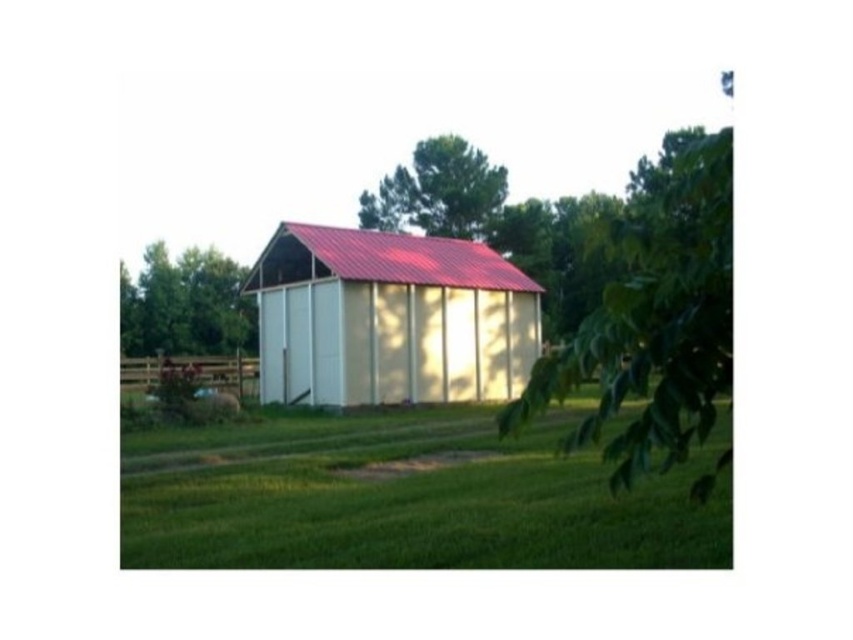
Based on the photo, does green grass at lower center have a lesser width compared to green leafy tree at left?

Yes.

Does green grass at lower center have a greater width compared to green leafy tree at left?

No, green grass at lower center is not wider than green leafy tree at left.

Is point (160, 561) farther from viewer compared to point (184, 285)?

No, (160, 561) is closer to viewer.

Where is `green grass at lower center`? This screenshot has height=640, width=853. green grass at lower center is located at coordinates click(405, 496).

Who is more distant from viewer, (378,268) or (194,273)?

The point (194,273) is more distant.

Is metallic white barn at center taller than green leafy tree at left?

Incorrect, metallic white barn at center's height is not larger of green leafy tree at left's.

Between point (323, 273) and point (172, 326), which one is positioned in front?

Point (323, 273) is in front.

You are a GUI agent. You are given a task and a screenshot of the screen. Output one action in this format:
    pyautogui.click(x=<x>, y=<y>)
    Task: Click on the metallic white barn at center
    The height and width of the screenshot is (640, 853).
    Given the screenshot: What is the action you would take?
    pyautogui.click(x=389, y=317)

Between metallic white barn at center and green leafy tree at upper center, which one has less height?

Standing shorter between the two is metallic white barn at center.

Does metallic white barn at center appear on the right side of green leafy tree at upper center?

Indeed, metallic white barn at center is positioned on the right side of green leafy tree at upper center.

Does point (384, 296) come closer to viewer compared to point (459, 184)?

Yes.

Where is `metallic white barn at center`? Image resolution: width=853 pixels, height=640 pixels. metallic white barn at center is located at coordinates (389, 317).